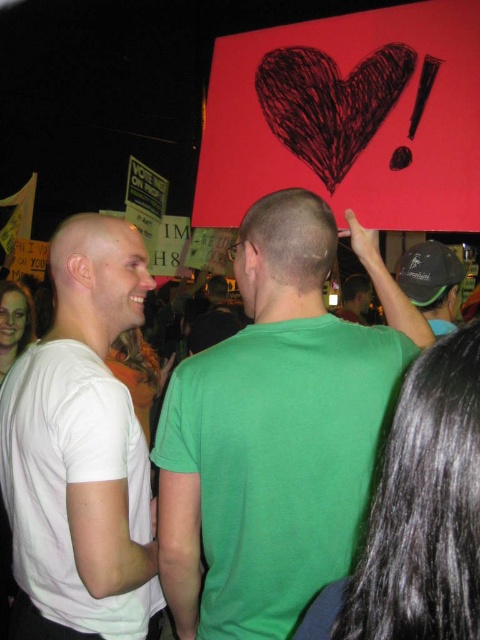
Question: Considering the relative positions of white matte t-shirt at center and white matte bald head at left in the image provided, where is white matte t-shirt at center located with respect to white matte bald head at left?

Choices:
 (A) below
 (B) above

Answer: (A)

Question: Can you confirm if white matte t-shirt at center is positioned above matte green shirt at center?

Choices:
 (A) yes
 (B) no

Answer: (B)

Question: Where is bald head at center located in relation to smooth skin head at upper left in the image?

Choices:
 (A) right
 (B) left

Answer: (A)

Question: Which of the following is the farthest from the observer?

Choices:
 (A) (275, 291)
 (B) (348, 314)
 (C) (50, 337)
 (D) (267, 244)

Answer: (B)

Question: Which point appears closest to the camera in this image?

Choices:
 (A) (330, 330)
 (B) (295, 280)
 (C) (83, 262)

Answer: (A)

Question: Considering the real-world distances, which object is farthest from the green matte t-shirt at center?

Choices:
 (A) bald head at center
 (B) white matte bald head at left
 (C) smooth skin head at upper left

Answer: (C)